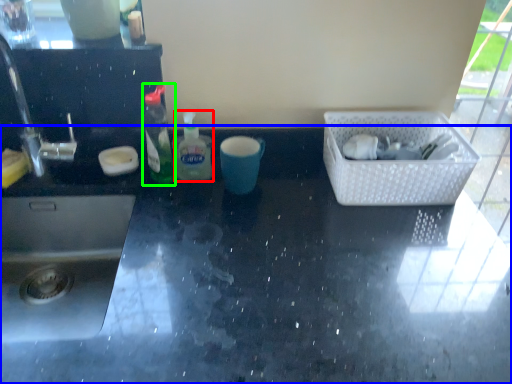
Question: Estimate the real-world distances between objects in this image. Which object is closer to bottle (highlighted by a red box), countertop (highlighted by a blue box) or bottle (highlighted by a green box)?

Choices:
 (A) countertop
 (B) bottle

Answer: (B)